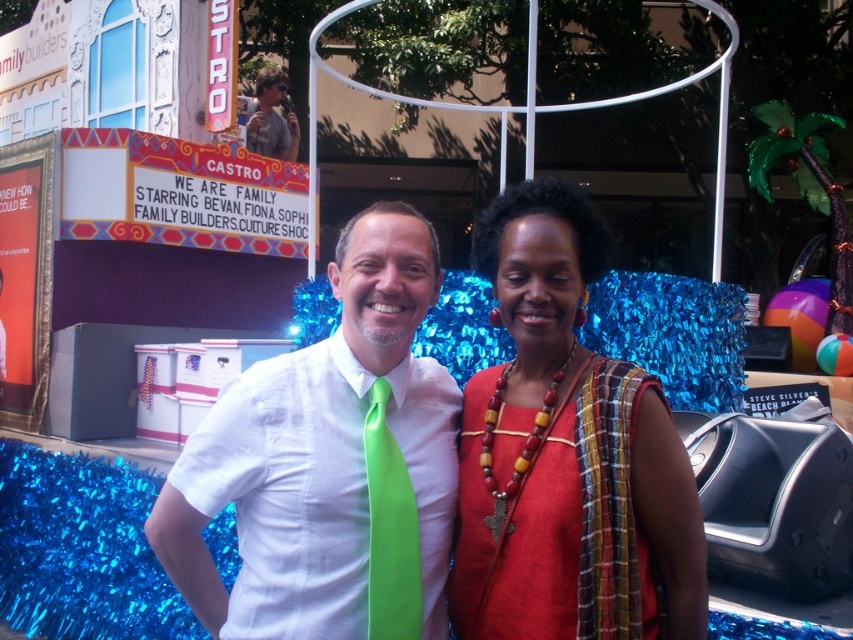
In the scene shown: Who is more distant from viewer, (235, 451) or (263, 90)?

Point (263, 90)

Can you confirm if matte white shirt with green tie at center is smaller than matte green tie at center?

No.

Between point (433, 392) and point (267, 99), which one is positioned behind?

Positioned behind is point (267, 99).

You are a GUI agent. You are given a task and a screenshot of the screen. Output one action in this format:
    pyautogui.click(x=<x>, y=<y>)
    Task: Click on the matte white shirt with green tie at center
    The width and height of the screenshot is (853, 640).
    Given the screenshot: What is the action you would take?
    pyautogui.click(x=323, y=456)

This screenshot has width=853, height=640. What do you see at coordinates (566, 452) in the screenshot?
I see `red fabric dress at center` at bounding box center [566, 452].

Where is `red fabric dress at center`? The image size is (853, 640). red fabric dress at center is located at coordinates (566, 452).

Where is `red fabric dress at center`? This screenshot has width=853, height=640. red fabric dress at center is located at coordinates (566, 452).

Is red fabric dress at center thinner than matte green tie at center?

No.

Between point (669, 429) and point (267, 76), which one is positioned behind?

Positioned behind is point (267, 76).

Which is in front, point (663, 522) or point (256, 84)?

Point (663, 522)

The image size is (853, 640). I want to click on red fabric dress at center, so click(x=566, y=452).